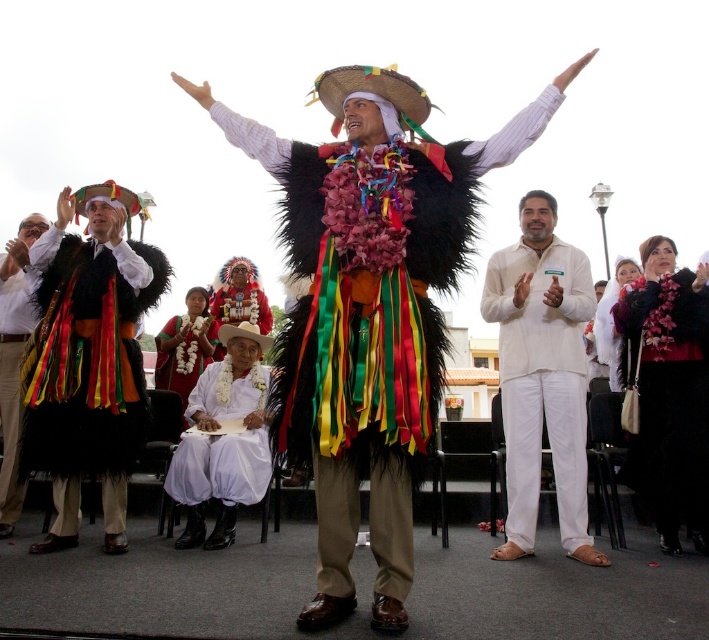
Can you confirm if feathered costume at center is positioned above matte black feathered vest at left?

Indeed, feathered costume at center is positioned over matte black feathered vest at left.

Can you confirm if feathered costume at center is thinner than matte black feathered vest at left?

No, feathered costume at center is not thinner than matte black feathered vest at left.

Image resolution: width=709 pixels, height=640 pixels. Find the location of `feathered costume at center`. feathered costume at center is located at coordinates (369, 317).

How distant is matte black feathered vest at left from white fabric at center?

matte black feathered vest at left is 19.94 meters away from white fabric at center.

Does matte black feathered vest at left have a lesser width compared to white fabric at center?

Indeed, matte black feathered vest at left has a lesser width compared to white fabric at center.

Measure the distance between point (6, 264) and camera.

→ Point (6, 264) is 124.04 feet away from camera.

At what (x,y) coordinates should I click in order to perform the action: click on matte black feathered vest at left. Please return your answer as a coordinate pair (x, y). Looking at the image, I should click on (13, 356).

Measure the distance between black feathered vest at left and matte black feathered vest at left.

black feathered vest at left and matte black feathered vest at left are 14.08 feet apart from each other.

Is black feathered vest at left positioned in front of matte black feathered vest at left?

Yes, it is in front of matte black feathered vest at left.

Which is in front, point (72, 314) or point (13, 380)?

Positioned in front is point (72, 314).

The image size is (709, 640). What are the coordinates of `black feathered vest at left` in the screenshot? It's located at (86, 376).